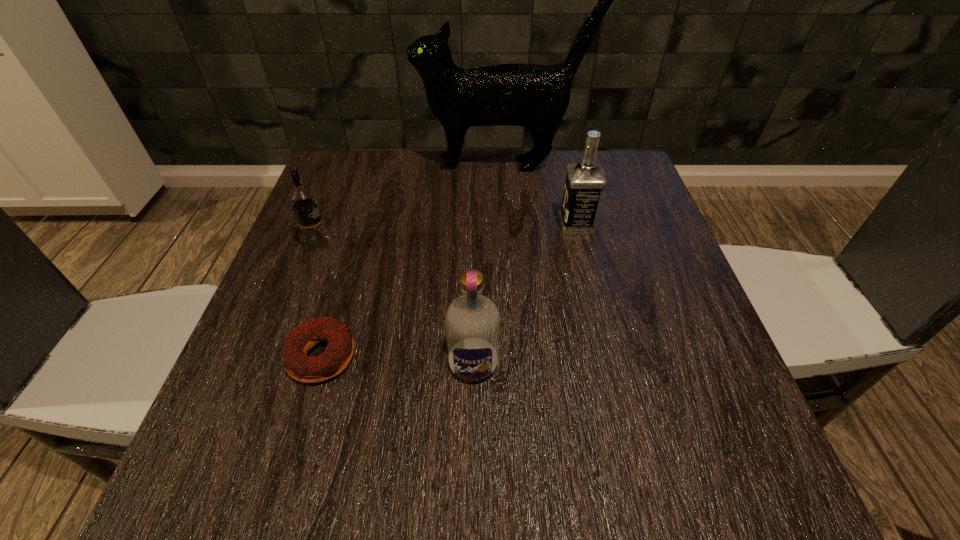
Where is `cat present at the right edge`? cat present at the right edge is located at coordinates (536, 97).

The width and height of the screenshot is (960, 540). In order to click on vodka present at the right edge in this screenshot , I will do `click(585, 181)`.

Locate an element on the screen. This screenshot has height=540, width=960. object that is positioned at the far right corner is located at coordinates (536, 97).

In order to click on vacant region at the far edge of the desktop in this screenshot , I will do `click(538, 199)`.

At what (x,y) coordinates should I click in order to perform the action: click on free space at the near edge. Please return your answer as a coordinate pair (x, y). This screenshot has height=540, width=960. Looking at the image, I should click on (594, 453).

The width and height of the screenshot is (960, 540). Find the location of `vacant area at the left edge of the desktop`. vacant area at the left edge of the desktop is located at coordinates (346, 218).

Identify the location of free space at the right edge. (x=628, y=258).

In the image, there is a desktop. Identify the location of vacant space at the far left corner. This screenshot has width=960, height=540. (374, 161).

Where is `vacant region at the far right corner of the desktop`? The image size is (960, 540). vacant region at the far right corner of the desktop is located at coordinates (618, 197).

Where is `free point between the second vodka from left to right and the cat`? free point between the second vodka from left to right and the cat is located at coordinates (488, 264).